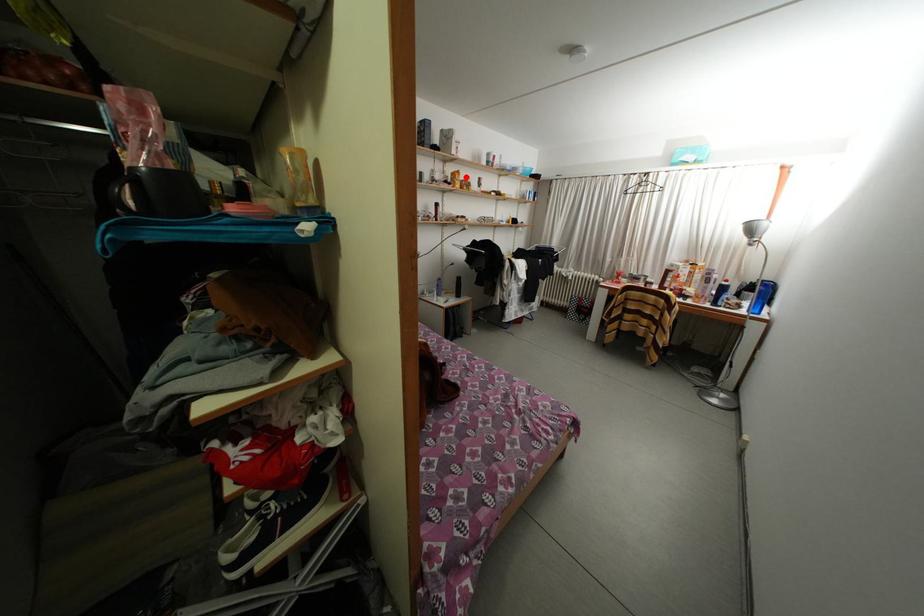
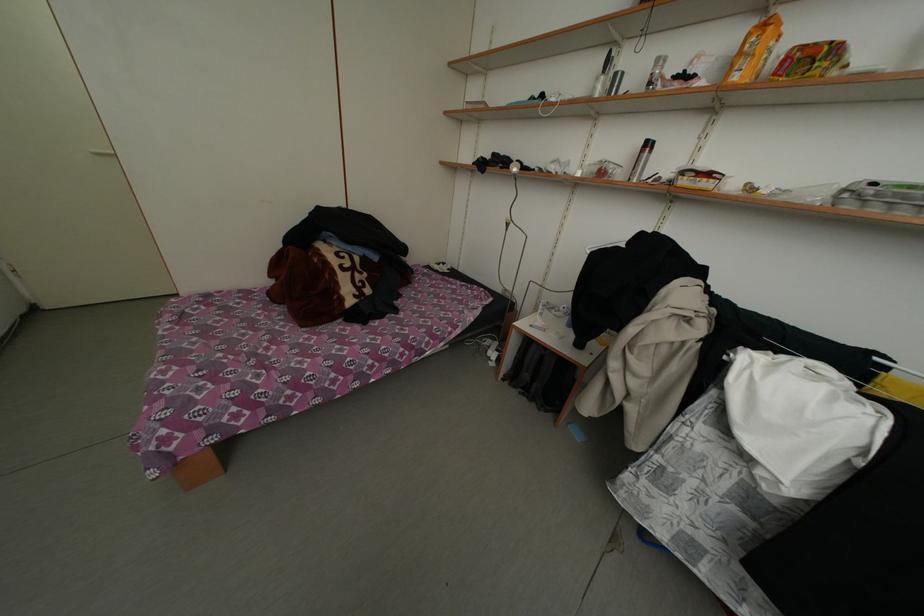
Locate, in the second image, the point that corresponds to the highlighted location in the first image.

(774, 29)